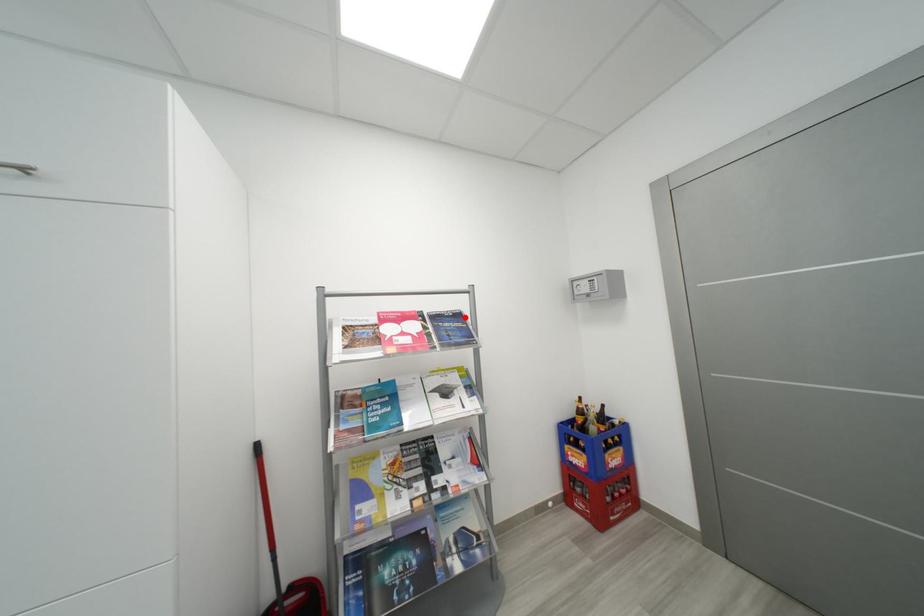
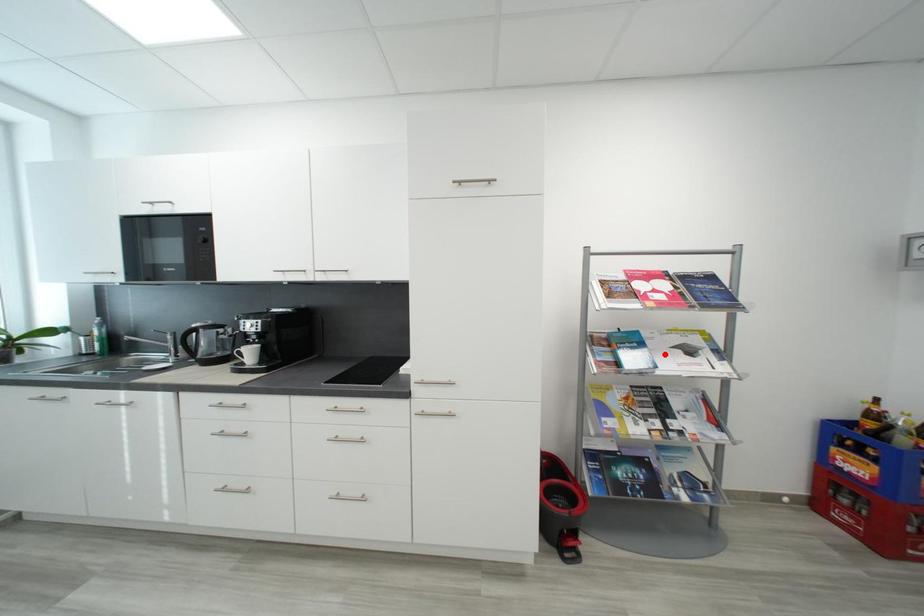
I am providing you with two images of the same scene from different viewpoints. A red point is marked on the first image and another point is marked on the second image. Are the points marked in image1 and image2 representing the same 3D position?

No